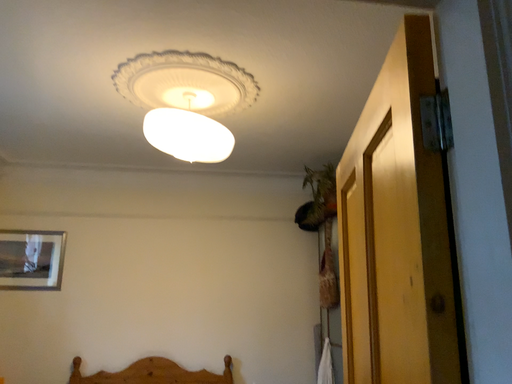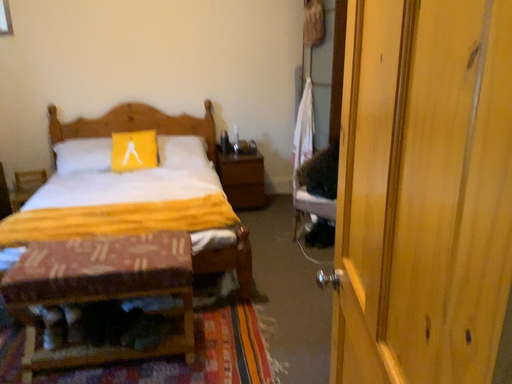
Question: Which way did the camera rotate in the video?

Choices:
 (A) rotated downward
 (B) rotated upward

Answer: (A)